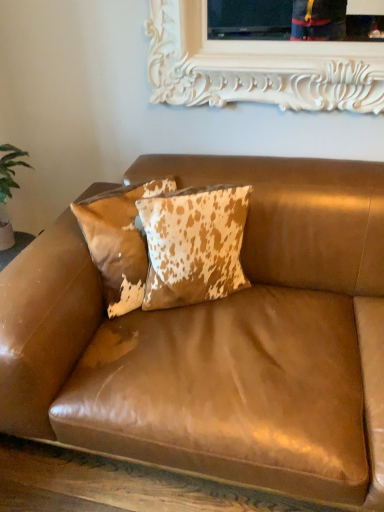
Question: From the image's perspective, is brown leather couch at center located above or below cowhide pillow at center, the first pillow in the left-to-right sequence?

Choices:
 (A) below
 (B) above

Answer: (A)

Question: From their relative heights in the image, would you say brown leather couch at center is taller or shorter than cowhide pillow at center, the first pillow in the left-to-right sequence?

Choices:
 (A) short
 (B) tall

Answer: (B)

Question: Which object is positioned farthest from the brown leather couch at center?

Choices:
 (A) cowhide pillow at center, the second pillow viewed from the left
 (B) cowhide pillow at center, the first pillow in the left-to-right sequence

Answer: (B)

Question: Which of these objects is positioned closest to the cowhide pillow at center, the second pillow viewed from the left?

Choices:
 (A) brown leather couch at center
 (B) cowhide pillow at center, positioned as the second pillow in right-to-left order

Answer: (B)